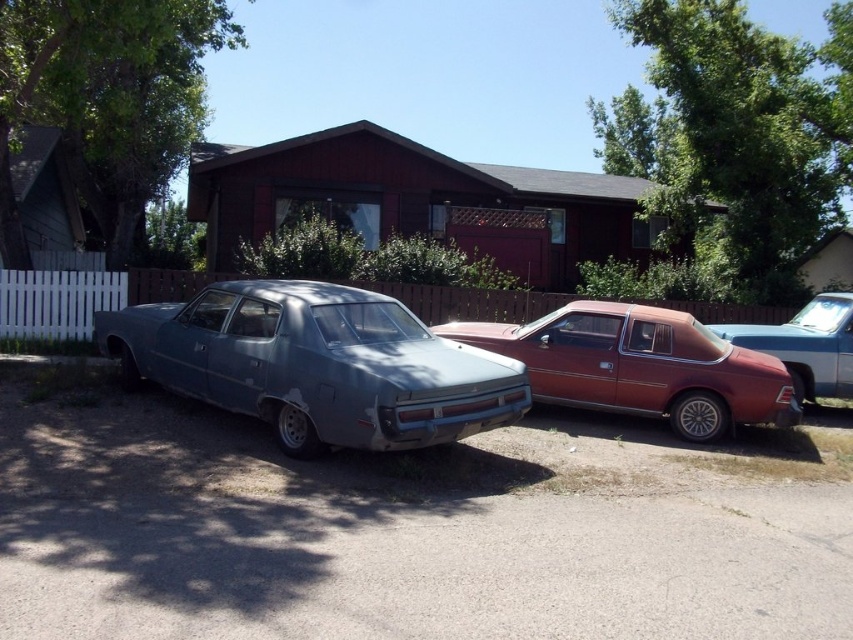
Question: Which object is farther from the camera taking this photo?

Choices:
 (A) smooth asphalt driveway at lower center
 (B) matte red car at center

Answer: (B)

Question: Is smooth asphalt driveway at lower center positioned behind matte blue sedan at center?

Choices:
 (A) yes
 (B) no

Answer: (B)

Question: Which object appears closest to the camera in this image?

Choices:
 (A) metallic red car at right
 (B) smooth asphalt driveway at lower center
 (C) matte blue sedan at center

Answer: (B)

Question: Is matte blue sedan at center below metallic red car at right?

Choices:
 (A) yes
 (B) no

Answer: (B)

Question: Considering the relative positions of matte blue sedan at center and metallic red car at right in the image provided, where is matte blue sedan at center located with respect to metallic red car at right?

Choices:
 (A) above
 (B) below

Answer: (A)

Question: Which of these objects is positioned farthest from the smooth asphalt driveway at lower center?

Choices:
 (A) matte blue sedan at center
 (B) metallic red car at right
 (C) matte red car at center

Answer: (B)